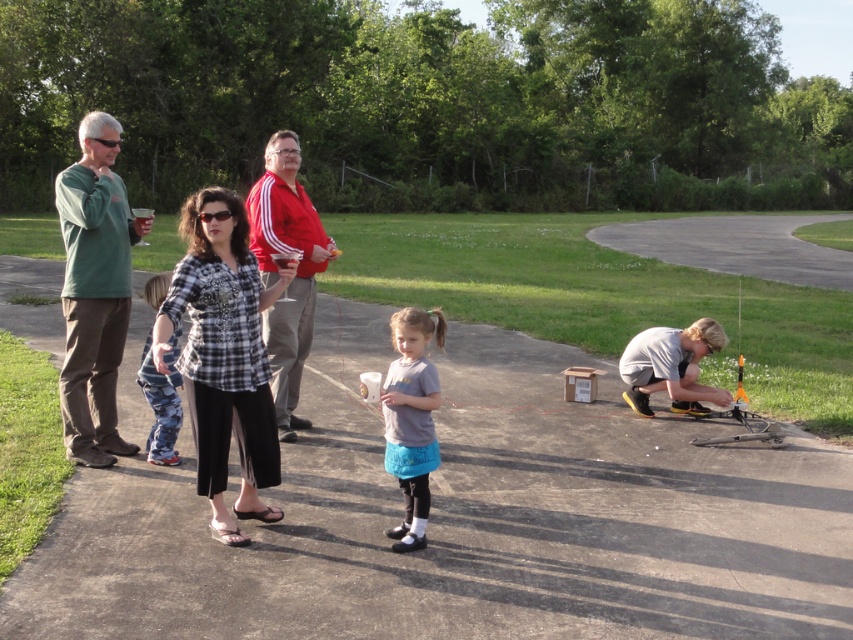
Question: Which of these objects is positioned closest to the red cotton shirt at center?

Choices:
 (A) camouflage pants at left
 (B) plaid fabric shirt at center

Answer: (B)

Question: Which is nearer to the plaid shirt at center?

Choices:
 (A) green matte shirt at left
 (B) camouflage pants at left
 (C) red cotton shirt at center
 (D) plaid fabric shirt at center

Answer: (D)

Question: Estimate the real-world distances between objects in this image. Which object is closer to the plaid fabric shirt at center?

Choices:
 (A) camouflage pants at left
 (B) green matte shirt at left
 (C) plaid shirt at center

Answer: (C)

Question: Does asphalt pavement at center have a greater width compared to green matte shirt at left?

Choices:
 (A) no
 (B) yes

Answer: (B)

Question: Is plaid shirt at center further to the viewer compared to gray matte shirt at center?

Choices:
 (A) yes
 (B) no

Answer: (B)

Question: Can you confirm if green matte shirt at left is wider than gray matte shirt at center?

Choices:
 (A) yes
 (B) no

Answer: (B)